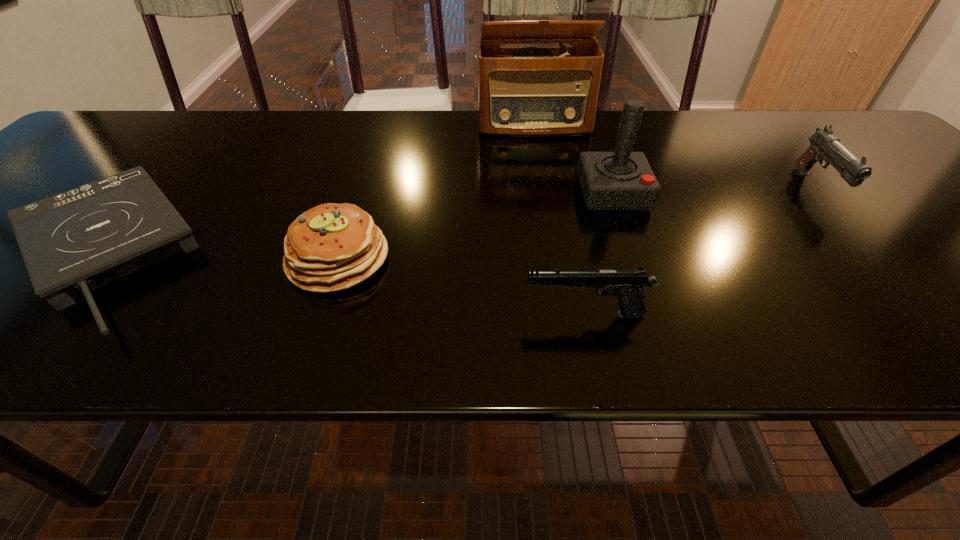
Locate an element on the screen. The image size is (960, 540). vacant area situated at the aiming end of the nearer gun is located at coordinates (364, 314).

What are the coordinates of `free space located 0.370m at the aiming end of the nearer gun` in the screenshot? It's located at (304, 314).

I want to click on vacant space situated 0.200m at the aiming end of the nearer gun, so [x=405, y=314].

At what (x,y) coordinates should I click in order to perform the action: click on free space located on the right of the fifth object from right to left. Please return your answer as a coordinate pair (x, y). Image resolution: width=960 pixels, height=540 pixels. Looking at the image, I should click on (579, 259).

Locate an element on the screen. object located in the far edge section of the desktop is located at coordinates (523, 91).

Where is `object at the near edge`? This screenshot has width=960, height=540. object at the near edge is located at coordinates (628, 285).

Find the location of a particular element. The height and width of the screenshot is (540, 960). vacant area at the far edge of the desktop is located at coordinates (429, 147).

The image size is (960, 540). Identify the location of free region at the right edge of the desktop. (863, 183).

The image size is (960, 540). Identify the location of vacant space at the far left corner of the desktop. (150, 120).

Where is `vacant space at the far right corner of the desktop`? This screenshot has height=540, width=960. vacant space at the far right corner of the desktop is located at coordinates (853, 130).